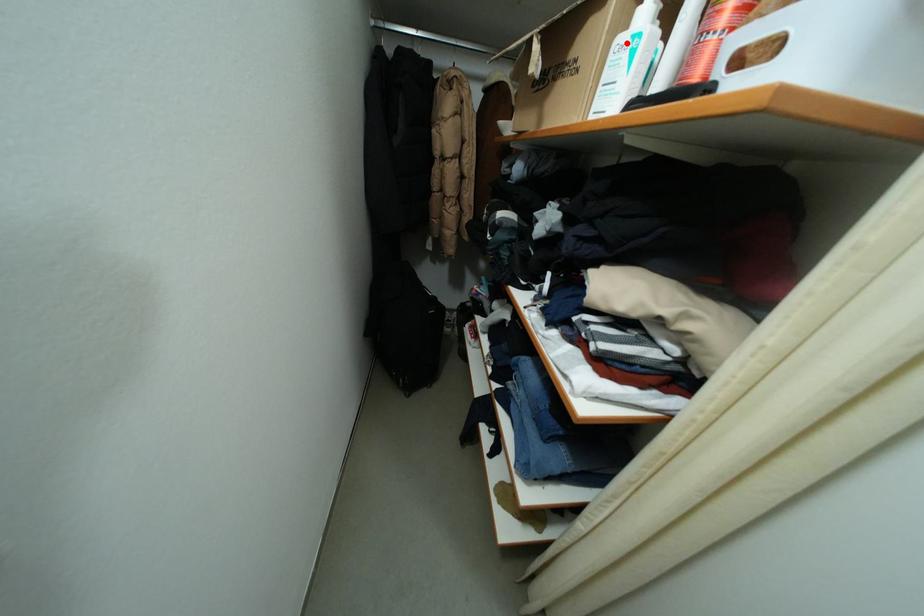
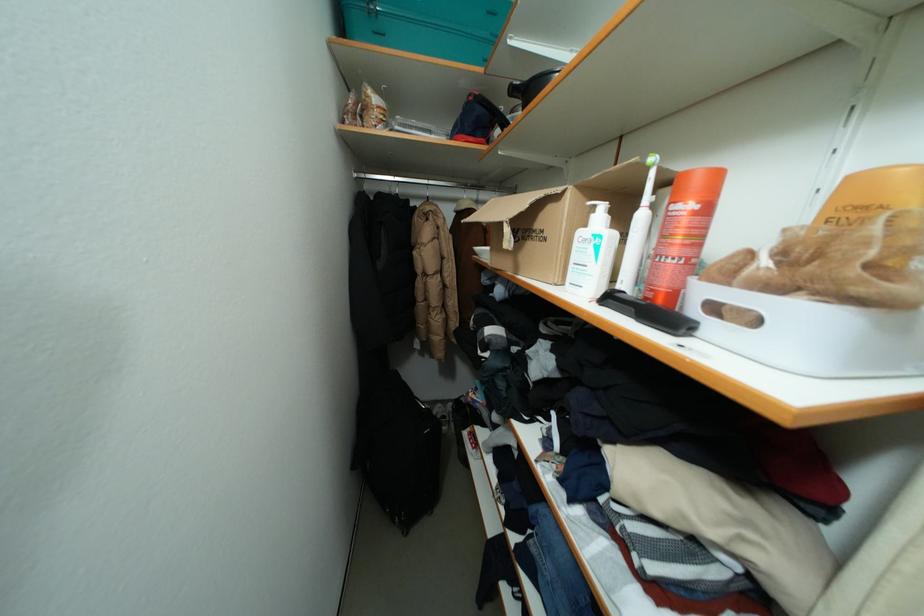
The point at the highlighted location is marked in the first image. Where is the corresponding point in the second image?

(589, 236)